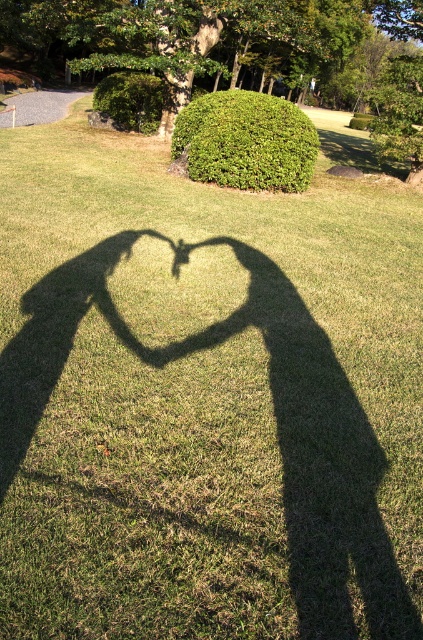
You are standing in the park and want to take a photo of the green leafy bush at upper center. Where should you position yourself to capture it in the frame?

The green leafy bush at upper center is located at point 0.222 on the horizontal axis and 0.584 on the vertical axis, so you should position yourself facing the upper center area of the scene to capture it in the frame.

You are standing in the park and want to take a photo of the green leafy bush at upper center. If you are currently 40.07 feet away from it, is that a suitable distance for a clear, detailed photo?

Yes, since you are exactly 40.07 feet away from the green leafy bush at upper center, which is the specified distance, this should allow for a clear and detailed photo.

You are a gardener who wants to plant a new bush in the garden. You see the green leafy bush at upper center and the green leafy hedge at upper center. Which one is narrower?

The green leafy bush at upper center is thinner than the green leafy hedge at upper center, so the green leafy bush at upper center is narrower.